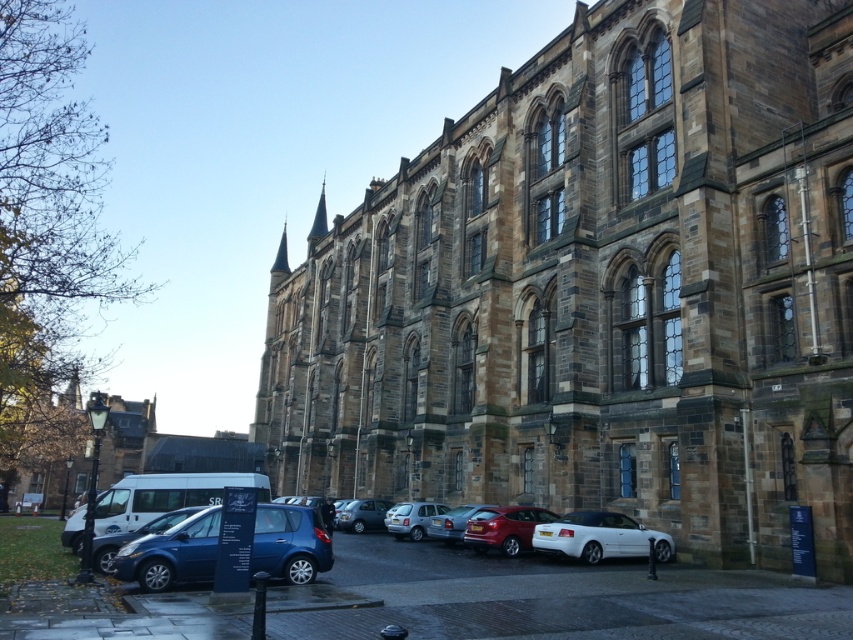
You are a delivery person who needs to park your 5.5 meter long truck between the white glossy sedan at lower center and the metallic silver car at lower center. Can you fit your truck in the space between them?

The white glossy sedan at lower center and metallic silver car at lower center are 10.98 meters apart. Since your truck is 5.5 meters long, there is sufficient space between them to park your truck.

You are a delivery person trying to park your truck which is 2 meters wide. You see the metallic silver cars at lower center and the metallic blue hatchback at center. Which parking spot between these two vehicles can accommodate your truck?

The metallic silver cars at lower center might be wider than metallic blue hatchback at center, so the space between them may not be wide enough for your 2 meter wide truck. Check the exact width before deciding.

You are a delivery person needing to park your van next to the metallic silver cars at lower center and the metallic blue hatchback at center. Given that your van is 6 meters long, can you safely maneuver it between them without hitting either vehicle?

The distance between the metallic silver cars at lower center and the metallic blue hatchback at center is 6.59 meters. Since your van is 6 meters long, there is enough space to park safely between them without collision.